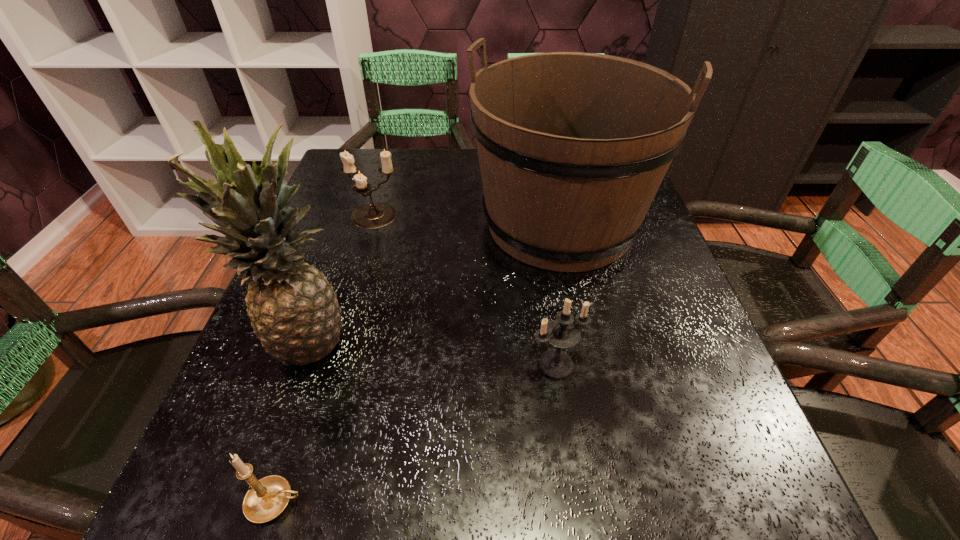
You are a GUI agent. You are given a task and a screenshot of the screen. Output one action in this format:
    pyautogui.click(x=<x>, y=<y>)
    Task: Click on the free space that is in between the pineapple and the nearest object
    The image size is (960, 540).
    Given the screenshot: What is the action you would take?
    pyautogui.click(x=290, y=421)

Identify which object is the second nearest to the bucket. Please provide its 2D coordinates. Your answer should be formatted as a tuple, i.e. [(x, y)], where the tuple contains the x and y coordinates of a point satisfying the conditions above.

[(373, 215)]

Locate an element on the screen. object that is the fourth nearest to the farthest candle holder is located at coordinates (267, 498).

I want to click on candle holder that can be found as the third closest to the pineapple, so click(x=561, y=333).

Select which candle holder appears as the closest to the second farthest candle holder. Please provide its 2D coordinates. Your answer should be formatted as a tuple, i.e. [(x, y)], where the tuple contains the x and y coordinates of a point satisfying the conditions above.

[(267, 498)]

You are a GUI agent. You are given a task and a screenshot of the screen. Output one action in this format:
    pyautogui.click(x=<x>, y=<y>)
    Task: Click on the vacant space that satisfies the following two spatial constraints: 1. on the front side of the rightmost candle holder; 2. on the handle side of the nearest object
    The width and height of the screenshot is (960, 540).
    Given the screenshot: What is the action you would take?
    pyautogui.click(x=577, y=502)

Where is `blank space that satisfies the following two spatial constraints: 1. on the back side of the bucket; 2. on the left side of the second nearest candle holder`? The height and width of the screenshot is (540, 960). blank space that satisfies the following two spatial constraints: 1. on the back side of the bucket; 2. on the left side of the second nearest candle holder is located at coordinates (536, 224).